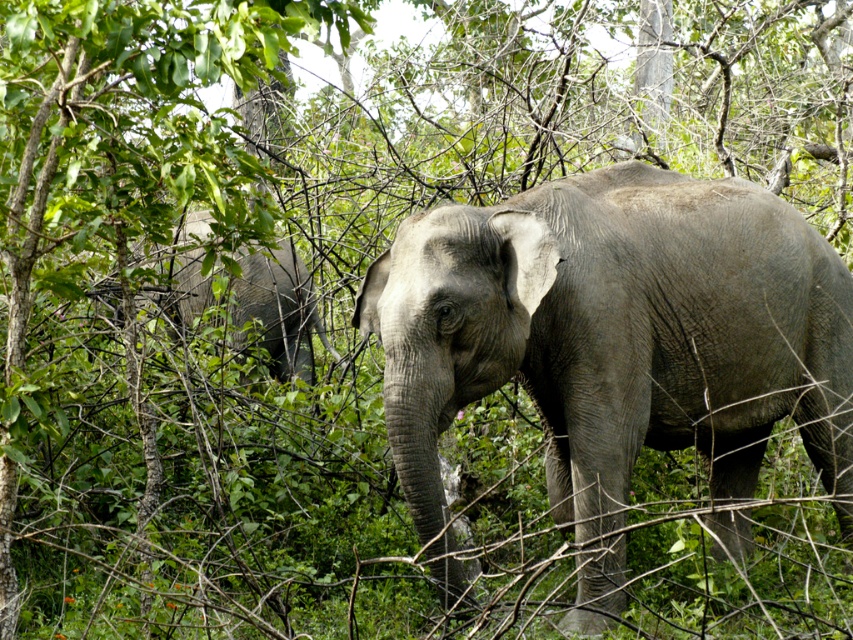
Can you confirm if gray matte elephant at center is positioned below gray matte elephant at left?

Correct, gray matte elephant at center is located below gray matte elephant at left.

I want to click on gray matte elephant at center, so click(x=616, y=342).